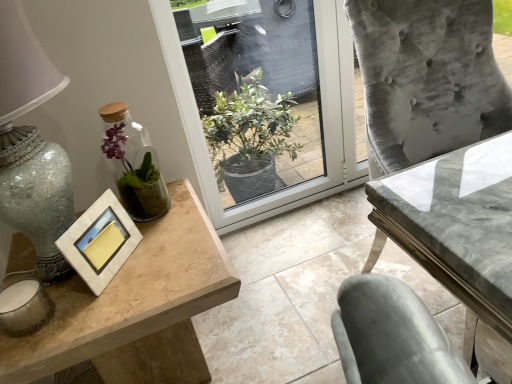
What are the coordinates of `free space in front of transparent glass window at center` in the screenshot? It's located at (291, 258).